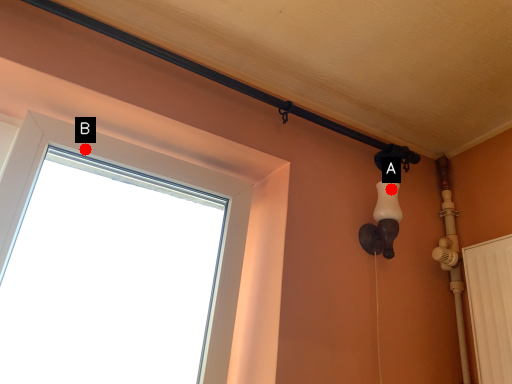
Question: Two points are circled on the image, labeled by A and B beside each circle. Among these points, which one is farthest from the camera?

Choices:
 (A) A is further
 (B) B is further

Answer: (A)